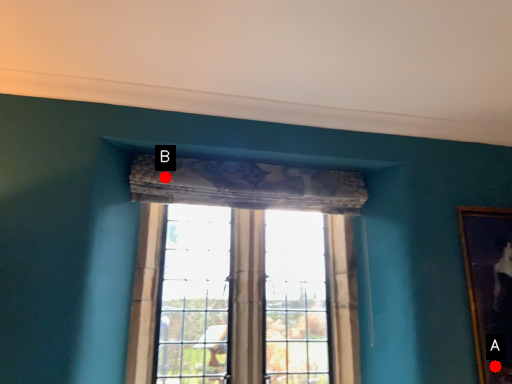
Question: Two points are circled on the image, labeled by A and B beside each circle. Among these points, which one is farthest from the camera?

Choices:
 (A) A is further
 (B) B is further

Answer: (B)